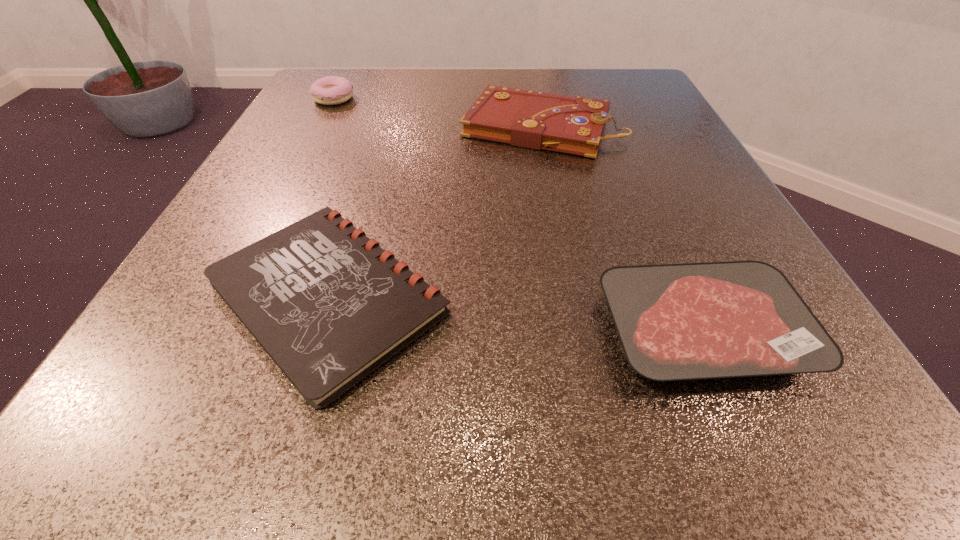
Identify the location of free spot between the taller notebook and the steak. The width and height of the screenshot is (960, 540). (622, 228).

In order to click on vacant region between the taller notebook and the nearer notebook in this screenshot , I will do tap(435, 211).

The width and height of the screenshot is (960, 540). I want to click on vacant area that lies between the taller notebook and the doughnut, so click(438, 112).

Locate an element on the screen. free space that is in between the doughnut and the taller notebook is located at coordinates (438, 112).

Locate an element on the screen. The width and height of the screenshot is (960, 540). vacant area that lies between the farther notebook and the shorter notebook is located at coordinates (435, 211).

Find the location of `free area in between the shorter notebook and the doughnut`. free area in between the shorter notebook and the doughnut is located at coordinates (331, 197).

I want to click on vacant point located between the steak and the nearer notebook, so click(516, 313).

Where is `free space between the shorter notebook and the taller notebook`? Image resolution: width=960 pixels, height=540 pixels. free space between the shorter notebook and the taller notebook is located at coordinates (435, 211).

Choose which object is the nearest neighbor to the doughnut. Please provide its 2D coordinates. Your answer should be formatted as a tuple, i.e. [(x, y)], where the tuple contains the x and y coordinates of a point satisfying the conditions above.

[(538, 120)]

Identify which object is the third nearest to the steak. Please provide its 2D coordinates. Your answer should be formatted as a tuple, i.e. [(x, y)], where the tuple contains the x and y coordinates of a point satisfying the conditions above.

[(331, 90)]